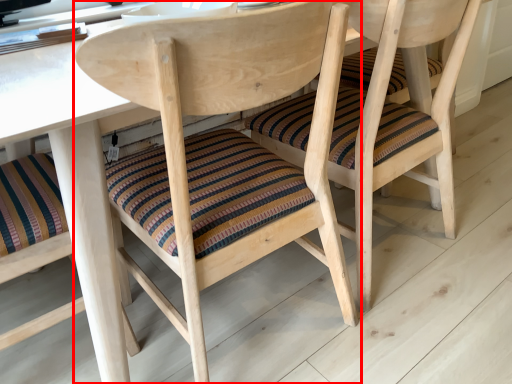
Question: From the image's perspective, what is the correct spatial relationship of chair (annotated by the red box) in relation to chair?

Choices:
 (A) above
 (B) below

Answer: (B)